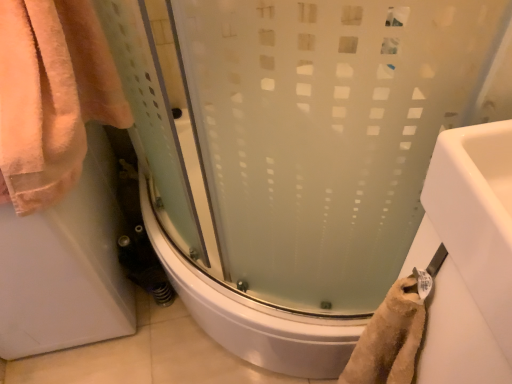
Question: Is pink terry cloth towel at left to the left or to the right of frosted glass shower door at center in the image?

Choices:
 (A) left
 (B) right

Answer: (A)

Question: In terms of width, does pink terry cloth towel at left look wider or thinner when compared to frosted glass shower door at center?

Choices:
 (A) wide
 (B) thin

Answer: (B)

Question: In terms of height, does pink terry cloth towel at left look taller or shorter compared to frosted glass shower door at center?

Choices:
 (A) short
 (B) tall

Answer: (B)

Question: Relative to pink terry cloth towel at left, is frosted glass shower door at center in front or behind?

Choices:
 (A) behind
 (B) front

Answer: (A)

Question: From the image's perspective, is frosted glass shower door at center positioned above or below pink terry cloth towel at left?

Choices:
 (A) below
 (B) above

Answer: (A)

Question: Considering the relative positions of frosted glass shower door at center and pink terry cloth towel at left in the image provided, is frosted glass shower door at center to the left or to the right of pink terry cloth towel at left?

Choices:
 (A) left
 (B) right

Answer: (B)

Question: Is point (385, 172) closer or farther from the camera than point (26, 21)?

Choices:
 (A) closer
 (B) farther

Answer: (A)